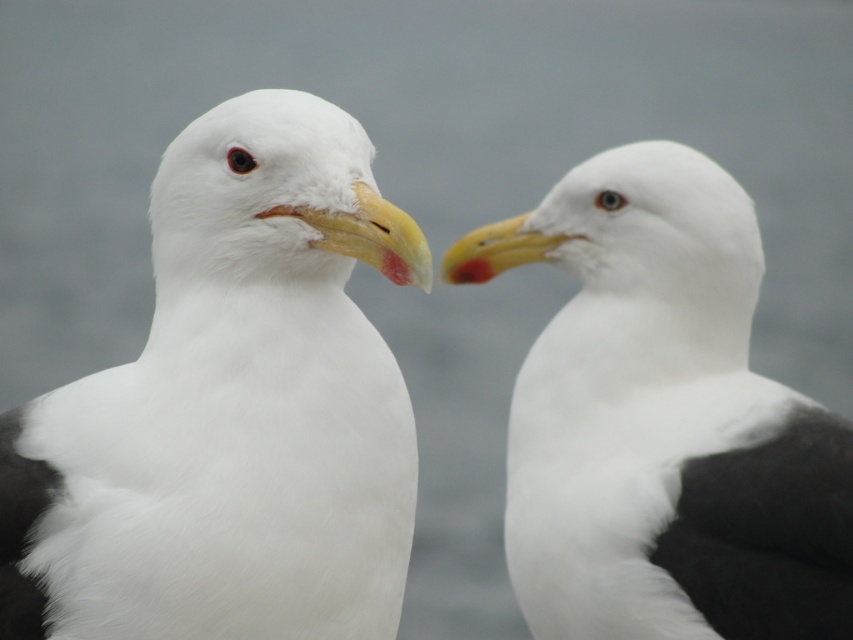
Which is in front, point (347, 486) or point (848, 512)?

Point (347, 486) is in front.

The width and height of the screenshot is (853, 640). I want to click on white fluffy seagull at center, so click(x=231, y=410).

I want to click on white fluffy seagull at center, so click(x=231, y=410).